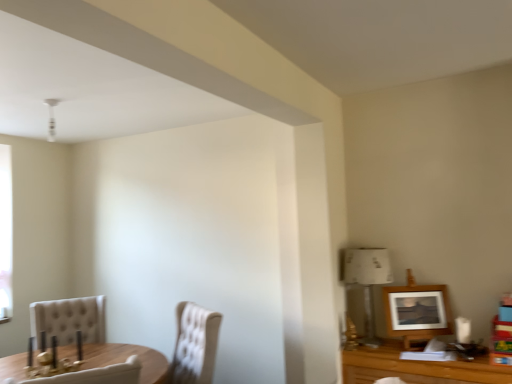
Question: From the image's perspective, is wooden picture frame at upper right over tufted fabric chair at lower left, the second chair positioned from the left?

Choices:
 (A) yes
 (B) no

Answer: (A)

Question: Considering the relative sizes of wooden picture frame at upper right and tufted fabric chair at lower left, the second chair positioned from the left, in the image provided, is wooden picture frame at upper right taller than tufted fabric chair at lower left, the second chair positioned from the left,?

Choices:
 (A) no
 (B) yes

Answer: (A)

Question: From a real-world perspective, is wooden picture frame at upper right positioned under tufted fabric chair at lower left, the second chair positioned from the left, based on gravity?

Choices:
 (A) no
 (B) yes

Answer: (A)

Question: Would you say tufted fabric chair at lower left, the second chair positioned from the left, is part of wooden picture frame at upper right's contents?

Choices:
 (A) yes
 (B) no

Answer: (B)

Question: Considering the relative sizes of wooden picture frame at upper right and tufted fabric chair at lower left, the second chair positioned from the left, in the image provided, is wooden picture frame at upper right wider than tufted fabric chair at lower left, the second chair positioned from the left,?

Choices:
 (A) yes
 (B) no

Answer: (B)

Question: Can you confirm if wooden picture frame at upper right is shorter than tufted fabric chair at lower left, the second chair positioned from the left?

Choices:
 (A) no
 (B) yes

Answer: (B)

Question: Considering the relative positions of white paper lampshade at right and tufted fabric chair at lower left, the second chair positioned from the left, in the image provided, is white paper lampshade at right behind tufted fabric chair at lower left, the second chair positioned from the left,?

Choices:
 (A) yes
 (B) no

Answer: (A)

Question: Does white paper lampshade at right have a lesser height compared to tufted fabric chair at lower left, the second chair positioned from the left?

Choices:
 (A) yes
 (B) no

Answer: (A)

Question: Considering the relative sizes of white paper lampshade at right and tufted fabric chair at lower left, marked as the 1th chair in a right-to-left arrangement, in the image provided, is white paper lampshade at right smaller than tufted fabric chair at lower left, marked as the 1th chair in a right-to-left arrangement,?

Choices:
 (A) yes
 (B) no

Answer: (A)

Question: Is white paper lampshade at right positioned before tufted fabric chair at lower left, marked as the 1th chair in a right-to-left arrangement?

Choices:
 (A) yes
 (B) no

Answer: (B)

Question: Considering the relative sizes of white paper lampshade at right and tufted fabric chair at lower left, marked as the 1th chair in a right-to-left arrangement, in the image provided, is white paper lampshade at right bigger than tufted fabric chair at lower left, marked as the 1th chair in a right-to-left arrangement,?

Choices:
 (A) yes
 (B) no

Answer: (B)

Question: Would you consider white paper lampshade at right to be distant from tufted fabric chair at lower left, the second chair positioned from the left?

Choices:
 (A) no
 (B) yes

Answer: (A)

Question: Are white paper lampshade at right and beige tufted chair at lower left, which is the 2th chair from right to left, making contact?

Choices:
 (A) no
 (B) yes

Answer: (A)